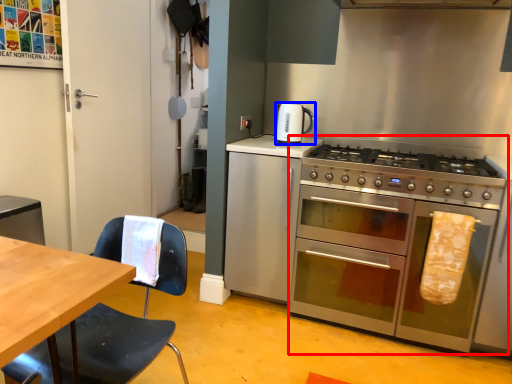
Question: Which point is further to the camera, oven (highlighted by a red box) or kitchen appliance (highlighted by a blue box)?

Choices:
 (A) oven
 (B) kitchen appliance

Answer: (B)